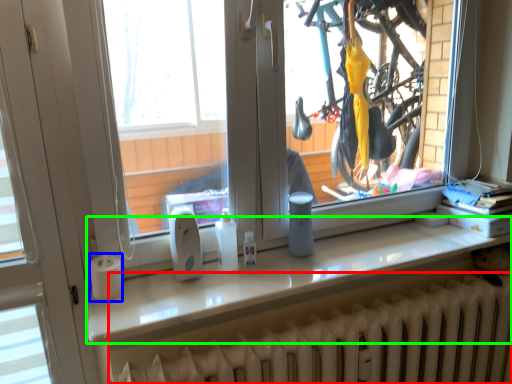
Question: Based on their relative distances, which object is farther from radiator (highlighted by a red box)? Choose from paper towel (highlighted by a blue box) and counter top (highlighted by a green box).

Choices:
 (A) paper towel
 (B) counter top

Answer: (A)